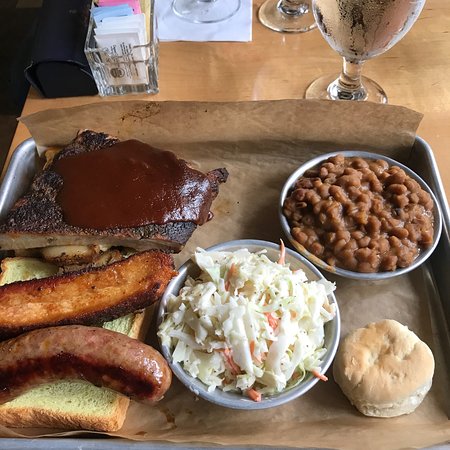
At what (x,y) coordinates should I click in order to perform the action: click on glass stem. Please return your answer as a coordinate pair (x, y). This screenshot has width=450, height=450. Looking at the image, I should click on (354, 80).